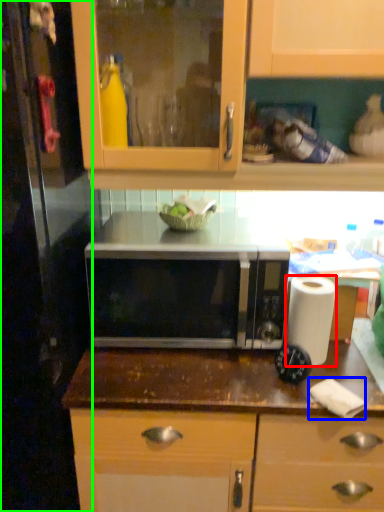
Question: Estimate the real-world distances between objects in this image. Which object is closer to paper towel (highlighted by a red box), toilet paper (highlighted by a blue box) or glass door (highlighted by a green box)?

Choices:
 (A) toilet paper
 (B) glass door

Answer: (A)